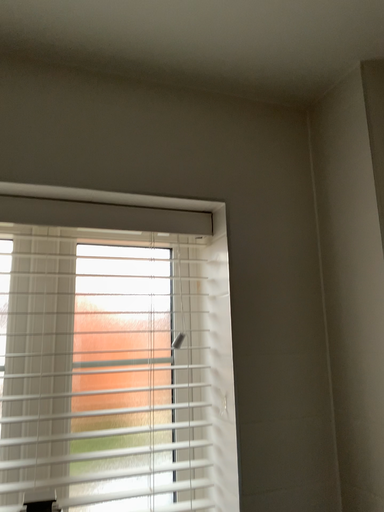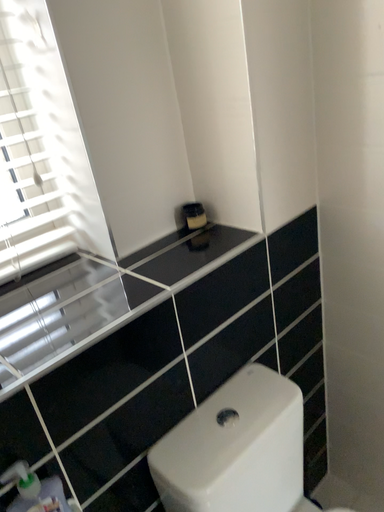
Question: Which way did the camera rotate in the video?

Choices:
 (A) rotated left
 (B) rotated right

Answer: (B)